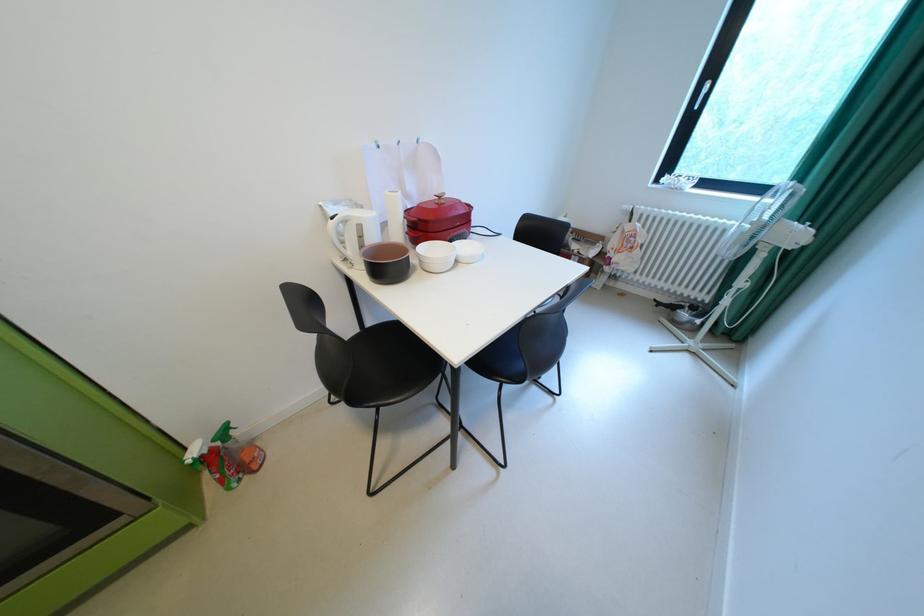
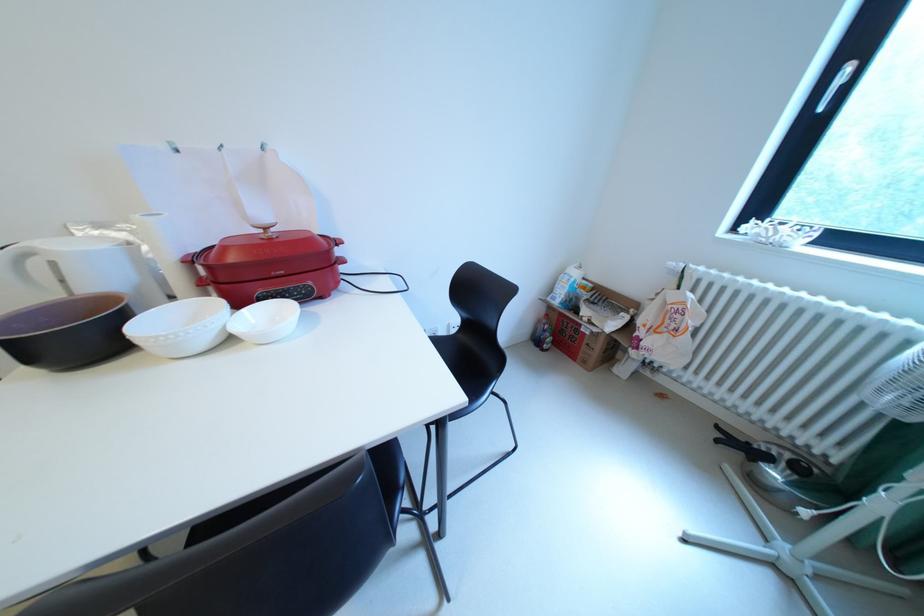
Find the pixel in the second image that matches point 447,203 in the first image.

(273, 237)